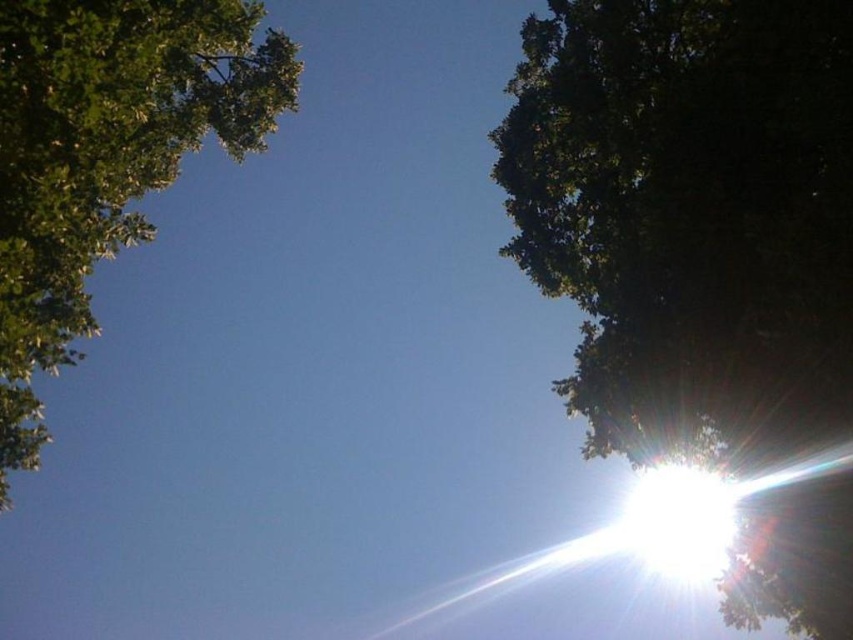
The width and height of the screenshot is (853, 640). What do you see at coordinates (689, 216) in the screenshot? I see `green leafy tree at upper right` at bounding box center [689, 216].

Is point (604, 442) closer to camera compared to point (113, 157)?

No.

The width and height of the screenshot is (853, 640). In order to click on green leafy tree at upper right in this screenshot , I will do `click(689, 216)`.